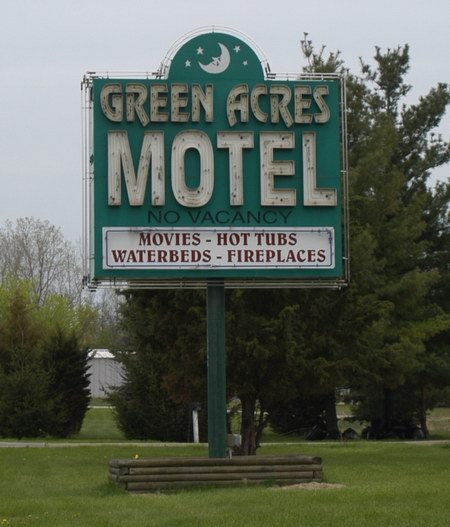
Identify the location of motel. (176, 180).